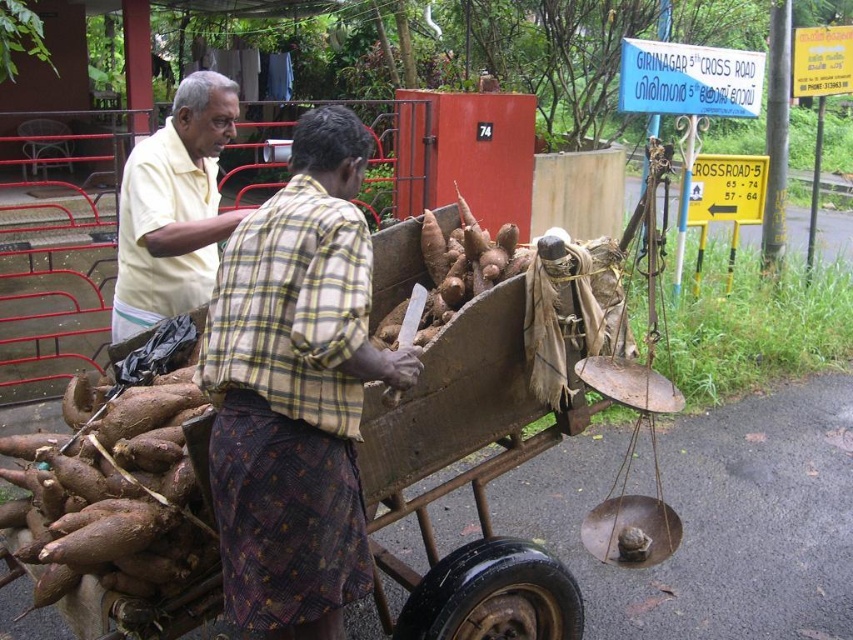
You are standing at the origin of the coordinate system. You see two points, point (109, 536) and point (259, 524). Which point is closer to you?

Point (109, 536) is behind point (259, 524), so the closer point to you is point (259, 524).